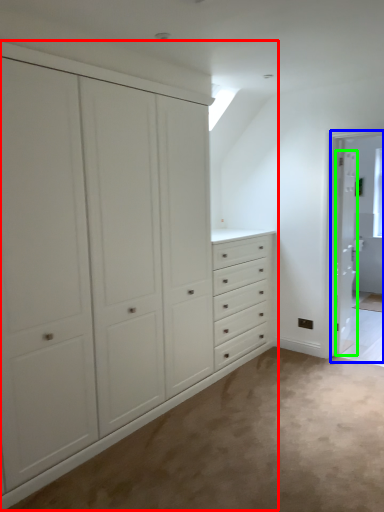
Question: Which object is the farthest from cupboard (highlighted by a red box)? Choose among these: screen door (highlighted by a blue box) or door (highlighted by a green box).

Choices:
 (A) screen door
 (B) door

Answer: (B)